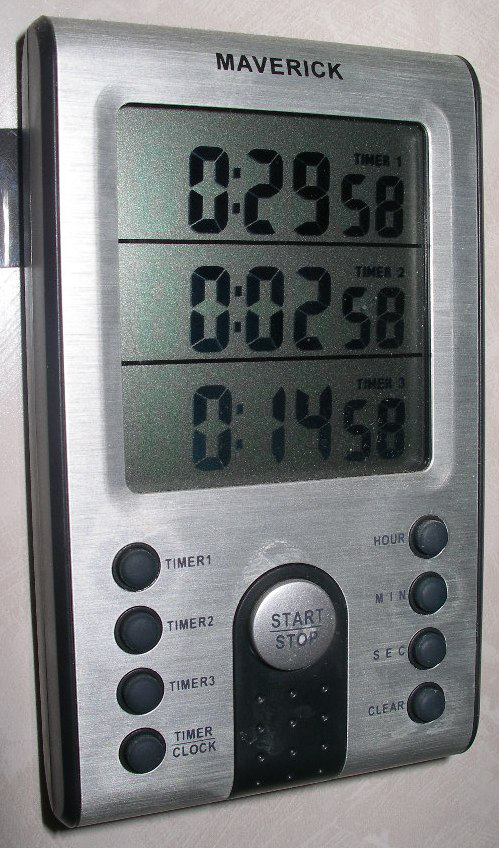
Image resolution: width=499 pixels, height=848 pixels. Identify the location of wall attachment. (9, 160).